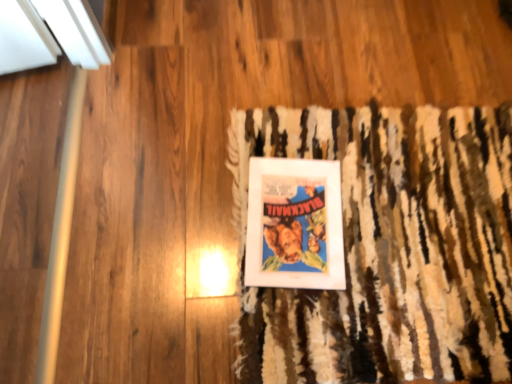
The height and width of the screenshot is (384, 512). Identify the location of blank space to the left of textured brown doormat at center. (169, 199).